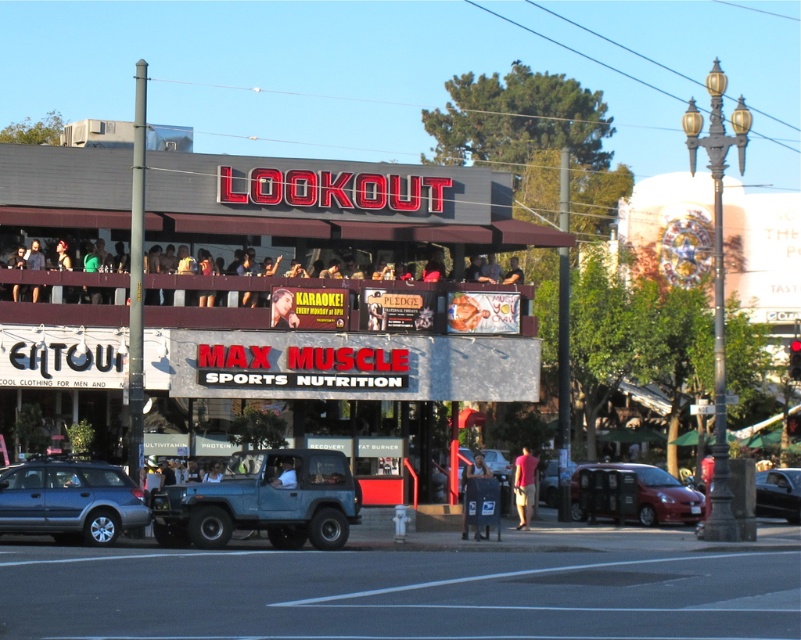
Consider the image. You are standing at point (290, 484) and want to walk to point (799, 477). Is the destination point behind you or in front of you?

The destination point (799, 477) is behind point (290, 484), so it is behind you.

You are a pedestrian standing at the entrance of MAX MUSCLE SPORTS NUTRITION store. You see a black glossy car at lower right and a light blue fabric shirt at center. Which object is positioned more to the right side of the scene?

The black glossy car at lower right is positioned more to the right side of the scene than the light blue fabric shirt at center.